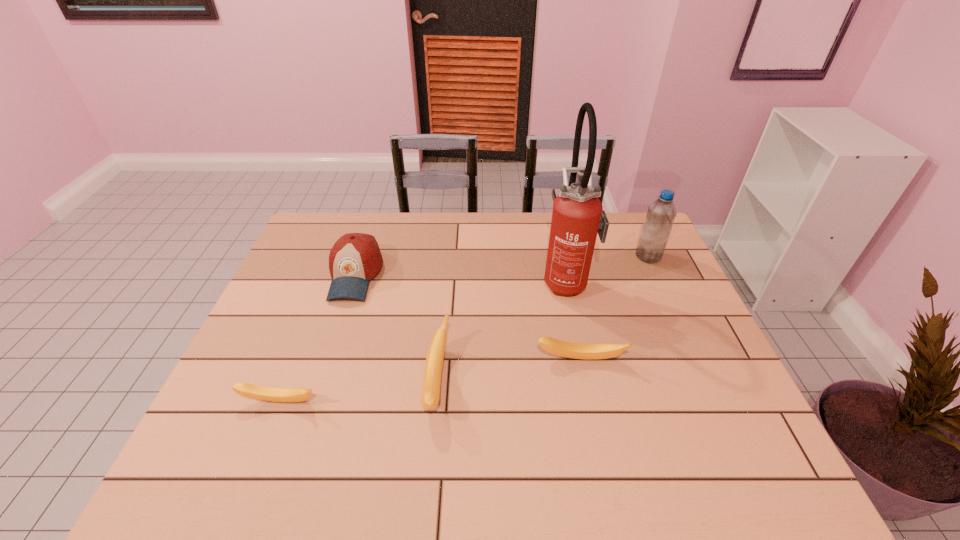
The height and width of the screenshot is (540, 960). I want to click on free space that is in between the rightmost object and the third object from left to right, so click(x=542, y=318).

Locate an element on the screen. Image resolution: width=960 pixels, height=540 pixels. free space between the fourth shortest object and the shortest object is located at coordinates (318, 339).

Image resolution: width=960 pixels, height=540 pixels. Identify the location of free area in between the fourth shortest object and the water bottle. (502, 266).

The width and height of the screenshot is (960, 540). I want to click on vacant space in between the third tallest object and the second tallest object, so click(x=502, y=266).

I want to click on vacant space that's between the fifth shortest object and the tallest object, so tap(608, 268).

The width and height of the screenshot is (960, 540). I want to click on empty space that is in between the fifth tallest object and the rightmost object, so click(614, 308).

Identify the location of empty space that is in between the fire extinguisher and the third object from left to right. Image resolution: width=960 pixels, height=540 pixels. (502, 330).

This screenshot has width=960, height=540. In order to click on blank region between the baseball cap and the fourth object from right to left in this screenshot , I will do `click(396, 327)`.

Locate an element on the screen. the fifth closest object to the shortest object is located at coordinates (661, 214).

This screenshot has height=540, width=960. I want to click on the fourth closest object to the second banana from left to right, so click(578, 214).